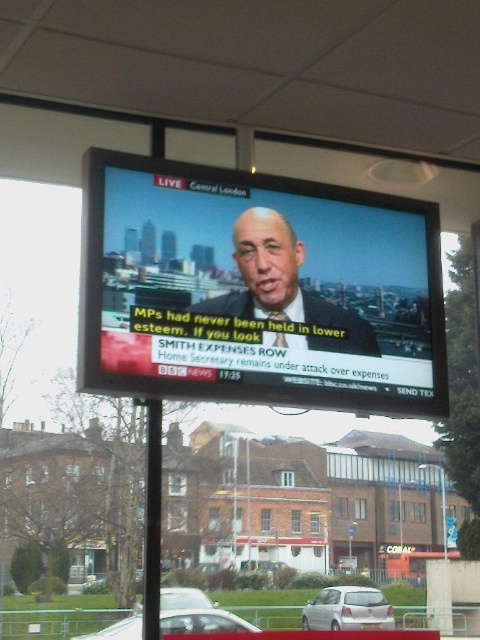
You are standing in front of a television screen that is 3.13 meters away from you. The screen is displaying a BBC News broadcast about a political scandal involving an MP and the Home Secretary. You want to take a photo of the screen with your smartphone, which has a maximum focus distance of 3 meters. Will your phone be able to focus on the matte black screen at center?

The matte black screen at center is 3.13 meters from the camera, which exceeds your smartphone camera maximum focus distance of 3 meters. Therefore, the phone will not be able to focus on the matte black screen at center.

You are a parking attendant who needs to fit a new car that is 2 meters long into the space between the white matte car at lower center and the silver metallic car at center. Is there enough space?

The white matte car at lower center and silver metallic car at center are 72.52 centimeters apart from each other. Since 72.52 centimeters is less than 2 meters, there is not enough space to fit the new car between them.